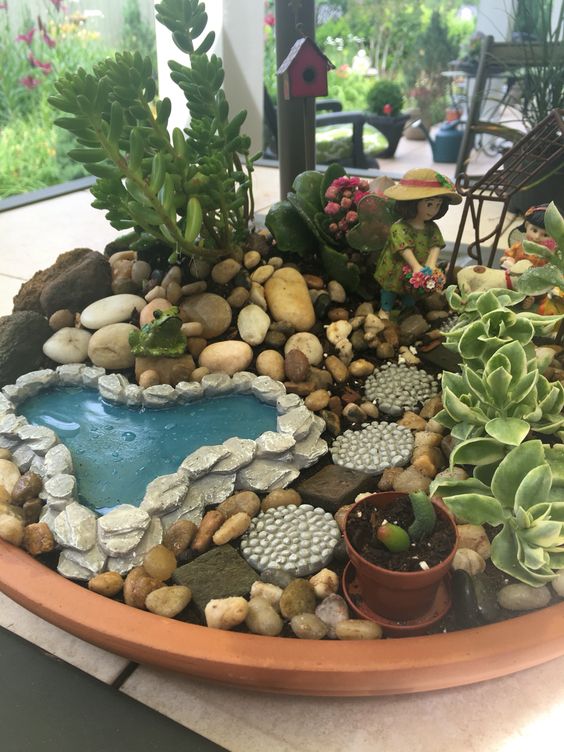
Find the location of a particular element. This screenshot has width=564, height=752. grey wall is located at coordinates (499, 5), (114, 10).